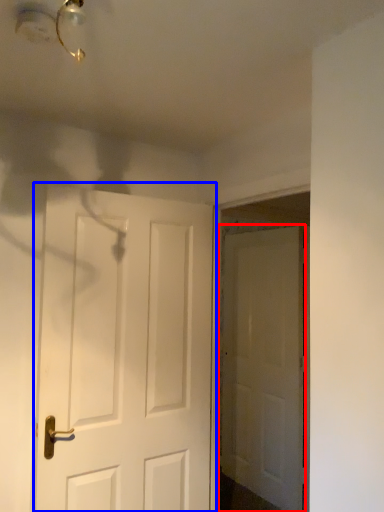
Question: Which object is closer to the camera taking this photo, door (highlighted by a red box) or door (highlighted by a blue box)?

Choices:
 (A) door
 (B) door

Answer: (B)